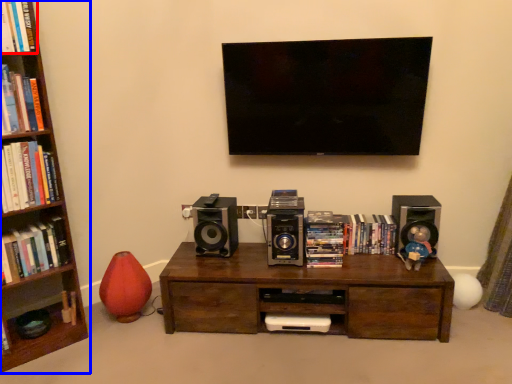
Question: Which point is further to the camera, book (highlighted by a red box) or bookcase (highlighted by a blue box)?

Choices:
 (A) book
 (B) bookcase

Answer: (A)